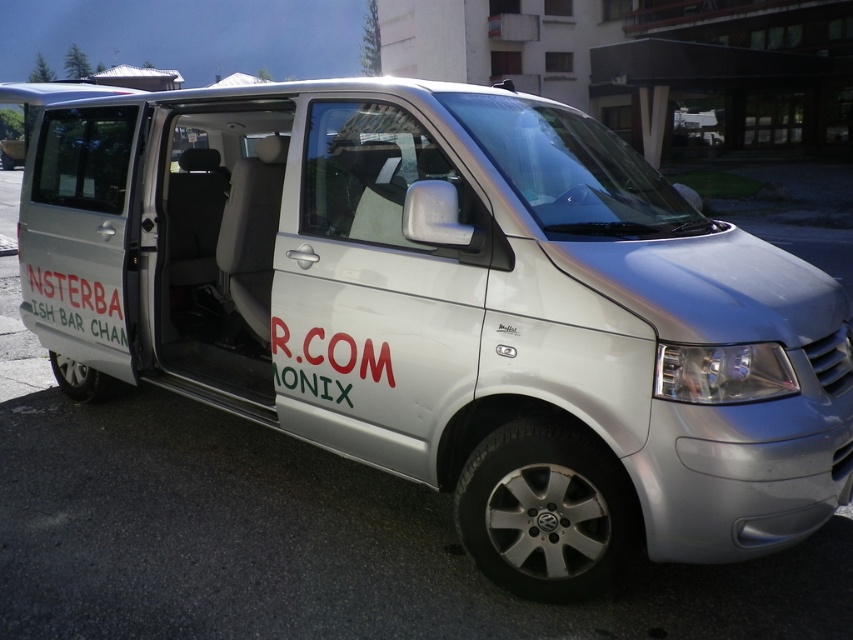
Question: Is white matte door at center positioned at the back of red matte text at center?

Choices:
 (A) no
 (B) yes

Answer: (B)

Question: Observing the image, what is the correct spatial positioning of white matte door at center in reference to white painted text at side?

Choices:
 (A) above
 (B) below

Answer: (A)

Question: Among these objects, which one is nearest to the camera?

Choices:
 (A) white painted text at side
 (B) red matte text at center

Answer: (B)

Question: Which of the following is the farthest from the observer?

Choices:
 (A) white matte door at center
 (B) white painted text at side
 (C) red matte text at center

Answer: (B)

Question: Which is farther from the red matte text at center?

Choices:
 (A) white matte door at center
 (B) white painted text at side

Answer: (B)

Question: Does white matte door at center appear under red matte text at center?

Choices:
 (A) no
 (B) yes

Answer: (A)